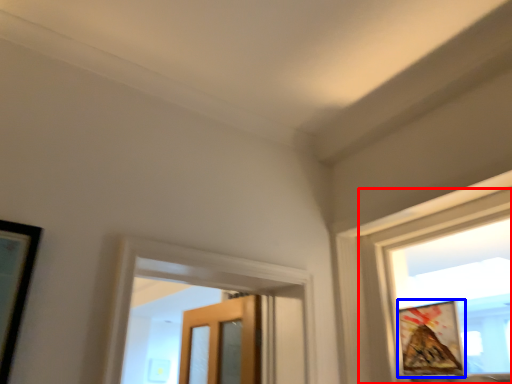
Question: Which object appears farthest to the camera in this image, window (highlighted by a red box) or picture frame (highlighted by a blue box)?

Choices:
 (A) window
 (B) picture frame

Answer: (B)